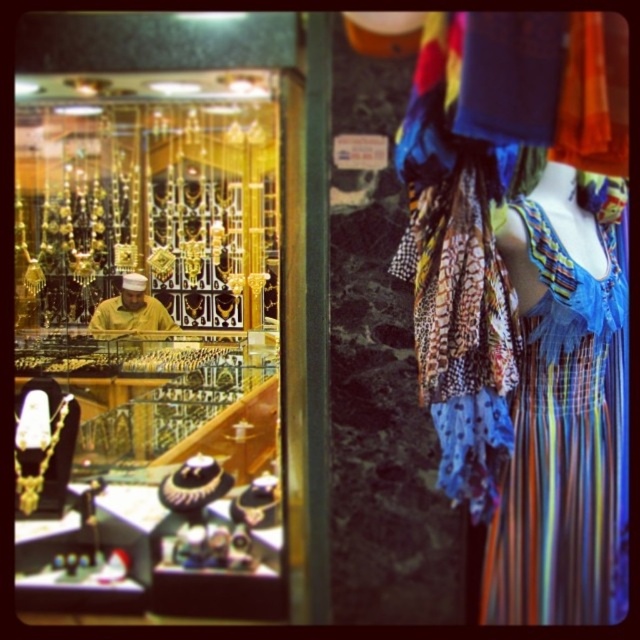
Question: Is gold/glass jewelry at center further to the viewer compared to yellow fabric at center?

Choices:
 (A) yes
 (B) no

Answer: (B)

Question: Considering the relative positions of multicolored striped dress at center and yellow fabric at center in the image provided, where is multicolored striped dress at center located with respect to yellow fabric at center?

Choices:
 (A) below
 (B) above

Answer: (A)

Question: Does multicolored striped dress at center appear on the right side of yellow fabric at center?

Choices:
 (A) no
 (B) yes

Answer: (B)

Question: Which of the following is the closest to the observer?

Choices:
 (A) (493, 512)
 (B) (152, 314)

Answer: (A)

Question: Which point appears farthest from the camera in this image?

Choices:
 (A) (115, 444)
 (B) (625, 364)
 (C) (145, 304)

Answer: (C)

Question: Based on their relative distances, which object is nearer to the multicolored striped dress at center?

Choices:
 (A) gold/glass jewelry at center
 (B) yellow fabric at center

Answer: (A)